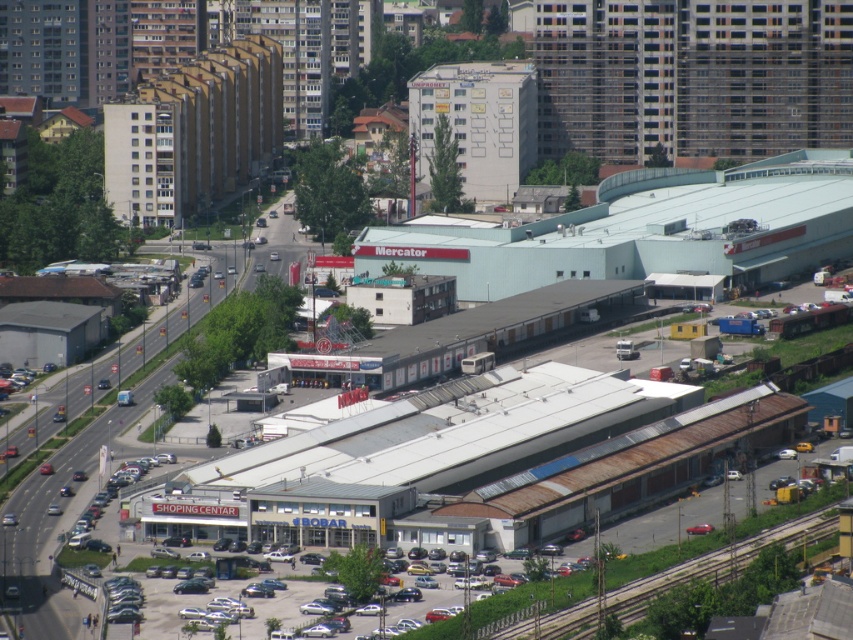
Question: Which of the following is the closest to the observer?

Choices:
 (A) (689, 76)
 (B) (811, 512)

Answer: (B)

Question: Does white corrugated metal shopping center at center appear on the left side of rusty metal train track at lower right?

Choices:
 (A) yes
 (B) no

Answer: (A)

Question: Observing the image, what is the correct spatial positioning of white corrugated metal shopping center at center in reference to rusty metal train track at lower right?

Choices:
 (A) right
 (B) left

Answer: (B)

Question: Can you confirm if white corrugated metal shopping center at center is smaller than rusty metal train track at lower right?

Choices:
 (A) no
 (B) yes

Answer: (A)

Question: Which point appears closest to the camera in this image?

Choices:
 (A) (491, 636)
 (B) (764, 145)

Answer: (A)

Question: Which point is farther to the camera?

Choices:
 (A) (59, 60)
 (B) (790, 524)

Answer: (A)